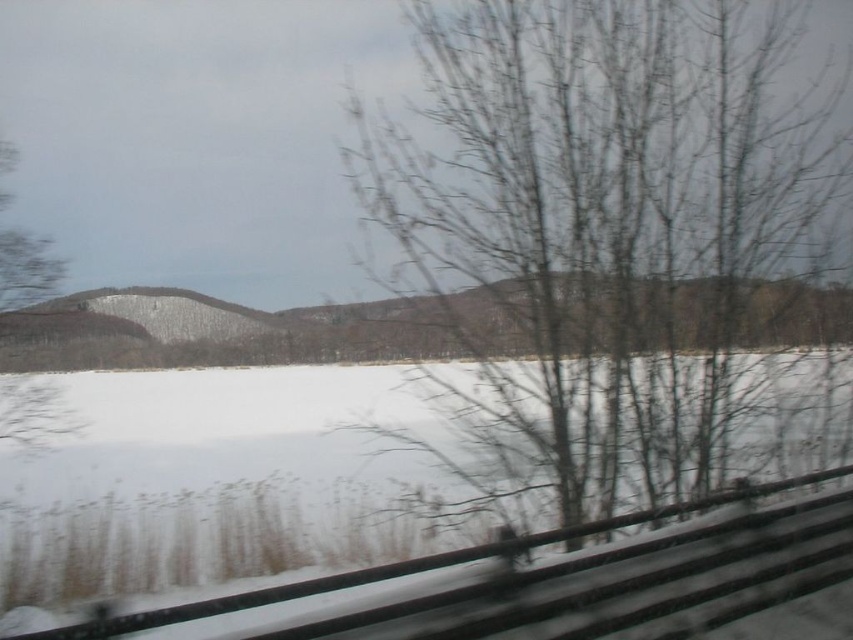
Between point (422, 257) and point (390, 499), which one is positioned in front?

Positioned in front is point (422, 257).

Does point (589, 456) come closer to viewer compared to point (93, 525)?

Yes, it is in front of point (93, 525).

The width and height of the screenshot is (853, 640). Find the location of `bare branches at center`. bare branches at center is located at coordinates (602, 230).

Is point (598, 106) positioned behind point (1, 257)?

No, (598, 106) is closer to viewer.

Is bare branches at center taller than green matte tree at left?

Indeed, bare branches at center has a greater height compared to green matte tree at left.

Does point (791, 104) lie in front of point (1, 227)?

Yes, it is.

This screenshot has height=640, width=853. I want to click on bare branches at center, so 602,230.

Does white matte snow at center have a greater width compared to green matte tree at left?

→ Indeed, white matte snow at center has a greater width compared to green matte tree at left.

The width and height of the screenshot is (853, 640). In order to click on white matte snow at center in this screenshot , I will do `click(207, 513)`.

Between point (144, 544) and point (41, 268), which one is positioned in front?

Point (41, 268) is more forward.

The width and height of the screenshot is (853, 640). What are the coordinates of `white matte snow at center` in the screenshot? It's located at (207, 513).